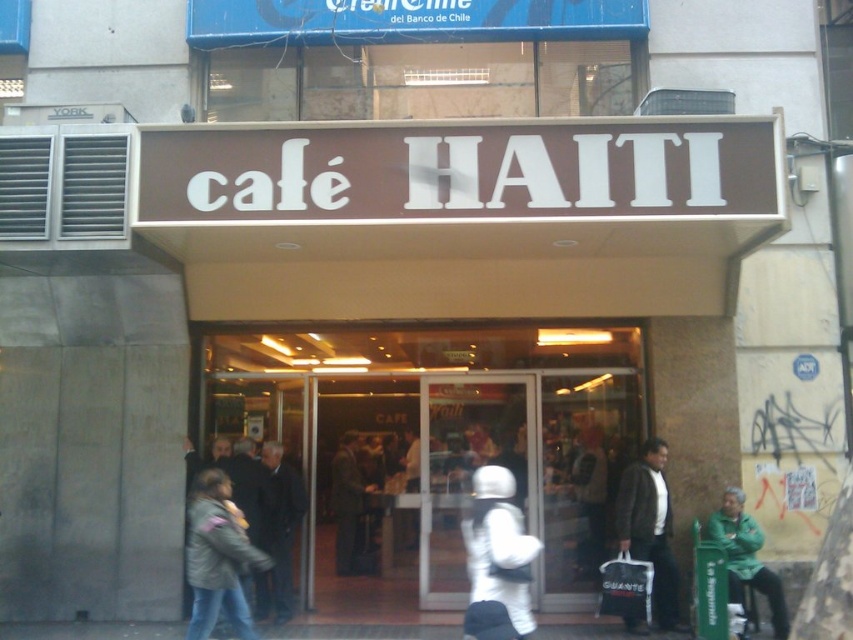
Question: Which point is closer to the camera?

Choices:
 (A) (746, 561)
 (B) (518, 458)
 (C) (231, 550)

Answer: (C)

Question: Does white matte astronaut suit at center appear on the right side of dark brown leather jacket at center?

Choices:
 (A) no
 (B) yes

Answer: (B)

Question: Which of the following is the farthest from the observer?

Choices:
 (A) matte glass door at center
 (B) dark brown leather jacket at lower right
 (C) white matte astronaut suit at center

Answer: (A)

Question: Which object is the farthest from the green fabric jacket at lower right?

Choices:
 (A) black leather coat at center
 (B) gray fuzzy jacket at lower left
 (C) matte glass door at center
 (D) dark brown leather jacket at center

Answer: (D)

Question: Is matte glass door at center wider than dark brown leather jacket at center?

Choices:
 (A) no
 (B) yes

Answer: (B)

Question: Considering the relative positions of matte glass door at center and gray fuzzy jacket at lower left in the image provided, where is matte glass door at center located with respect to gray fuzzy jacket at lower left?

Choices:
 (A) below
 (B) above

Answer: (B)